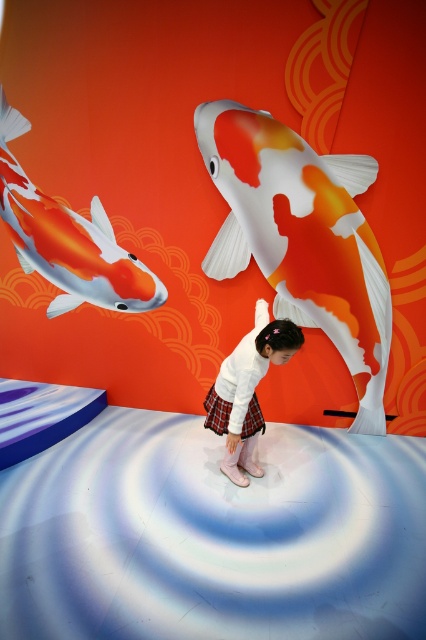
Which is above, orange and white glossy koi fish at upper left or white matte skirt at center?

Positioned higher is orange and white glossy koi fish at upper left.

Is orange and white glossy koi fish at upper left taller than white matte skirt at center?

No, orange and white glossy koi fish at upper left is not taller than white matte skirt at center.

Who is more distant from viewer, (71,296) or (247,353)?

Positioned behind is point (247,353).

Identify the location of orange and white glossy koi fish at upper left. (68, 240).

Who is taller, orange and white painted fish at center or white matte skirt at center?

orange and white painted fish at center is taller.

Based on the photo, is the position of orange and white painted fish at center more distant than that of white matte skirt at center?

No, it is in front of white matte skirt at center.

Is point (339, 346) positioned in front of point (222, 388)?

That is True.

Find the location of a particular element. The width and height of the screenshot is (426, 640). orange and white painted fish at center is located at coordinates (302, 237).

Is point (262, 209) positioned in front of point (71, 256)?

No, (262, 209) is further to viewer.

Is point (321, 230) positioned after point (55, 230)?

Yes, it is behind point (55, 230).

This screenshot has height=640, width=426. What are the coordinates of `orange and white painted fish at center` in the screenshot? It's located at (302, 237).